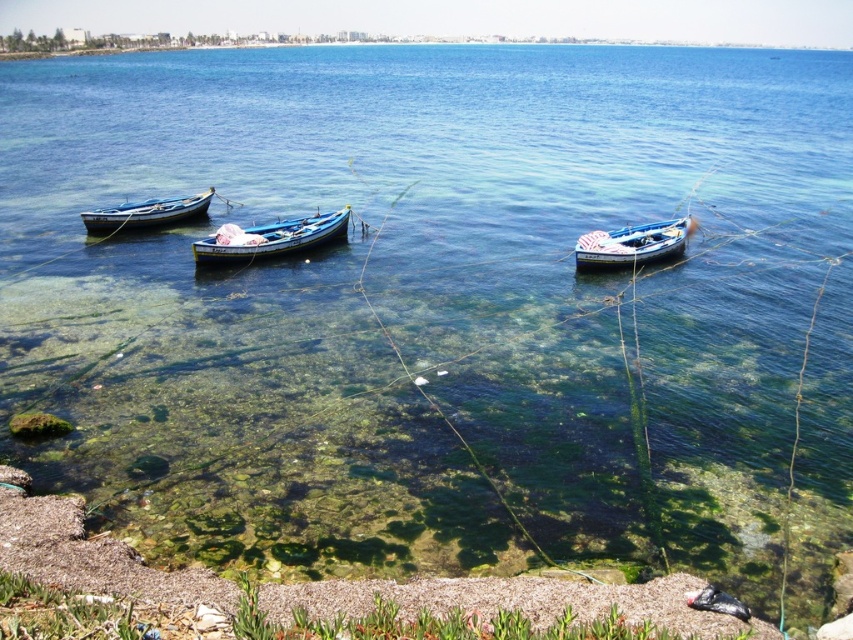
Question: Can you confirm if blue wooden boat at center is smaller than wooden boat at left?

Choices:
 (A) no
 (B) yes

Answer: (B)

Question: Is wooden blue boat at center to the left of wooden boat at left from the viewer's perspective?

Choices:
 (A) yes
 (B) no

Answer: (B)

Question: Among these points, which one is farthest from the camera?

Choices:
 (A) (241, 253)
 (B) (677, 224)

Answer: (B)

Question: Can you confirm if blue wooden boat at center is smaller than wooden boat at left?

Choices:
 (A) yes
 (B) no

Answer: (A)

Question: Estimate the real-world distances between objects in this image. Which object is closer to the blue wooden boat at center?

Choices:
 (A) wooden blue boat at center
 (B) wooden boat at left

Answer: (A)

Question: Which of the following is the farthest from the observer?

Choices:
 (A) (643, 243)
 (B) (292, 236)
 (C) (149, 224)

Answer: (C)